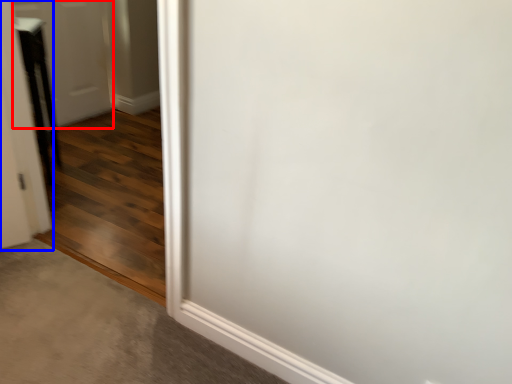
Question: Which of the following is the farthest to the observer, door (highlighted by a red box) or door (highlighted by a blue box)?

Choices:
 (A) door
 (B) door

Answer: (A)